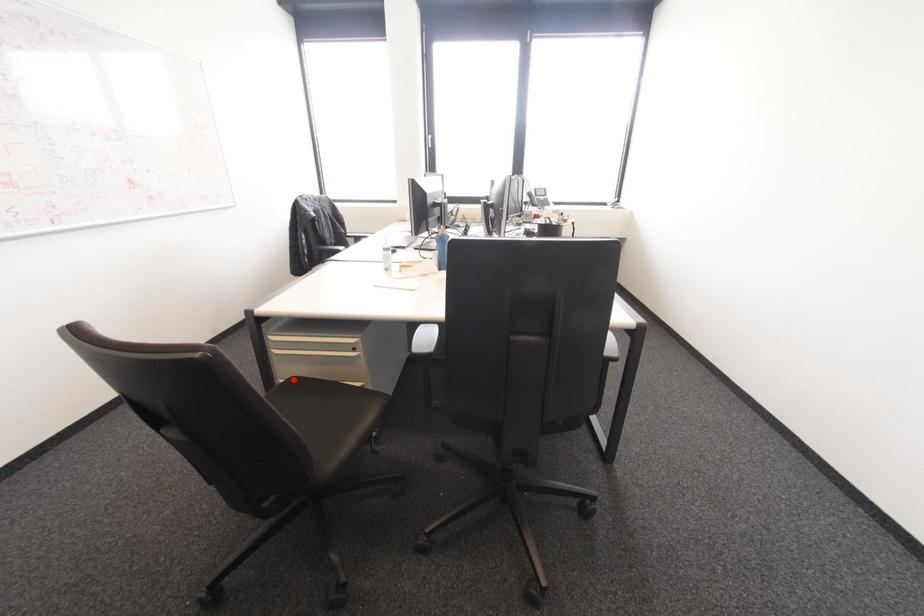
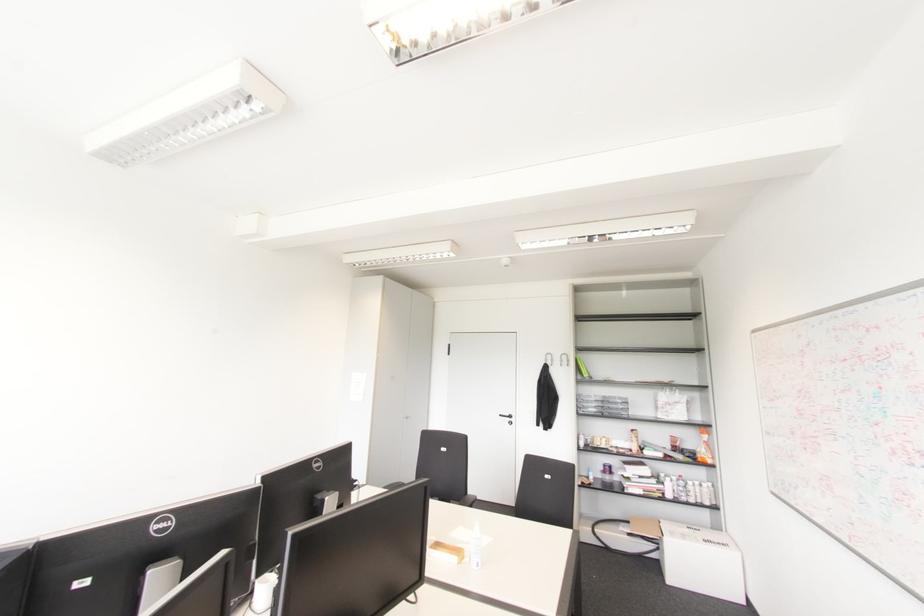
Question: I am providing you with two images of the same scene from different viewpoints. A red point is marked on the first image. Can you still see the location of the red point in image 2?

Choices:
 (A) Yes
 (B) No

Answer: (B)